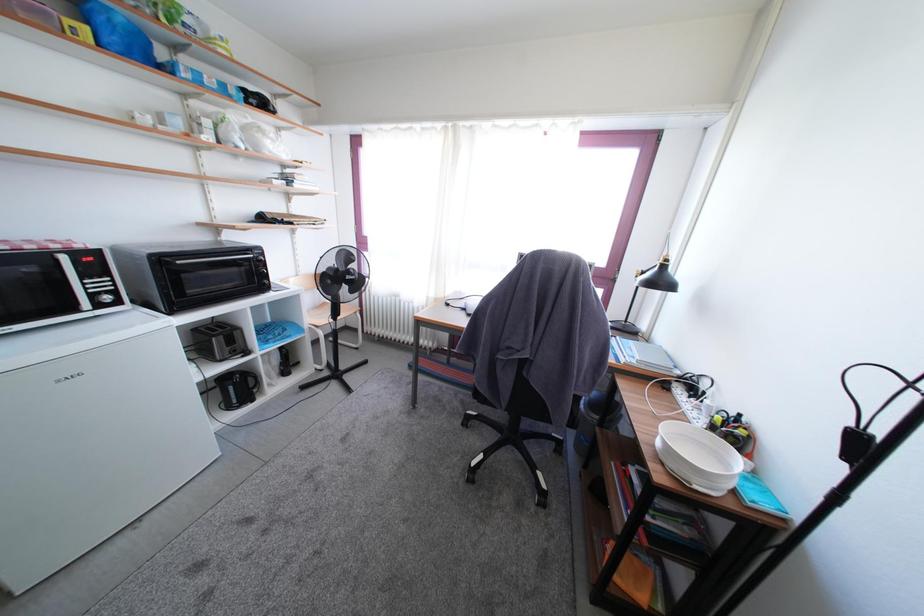
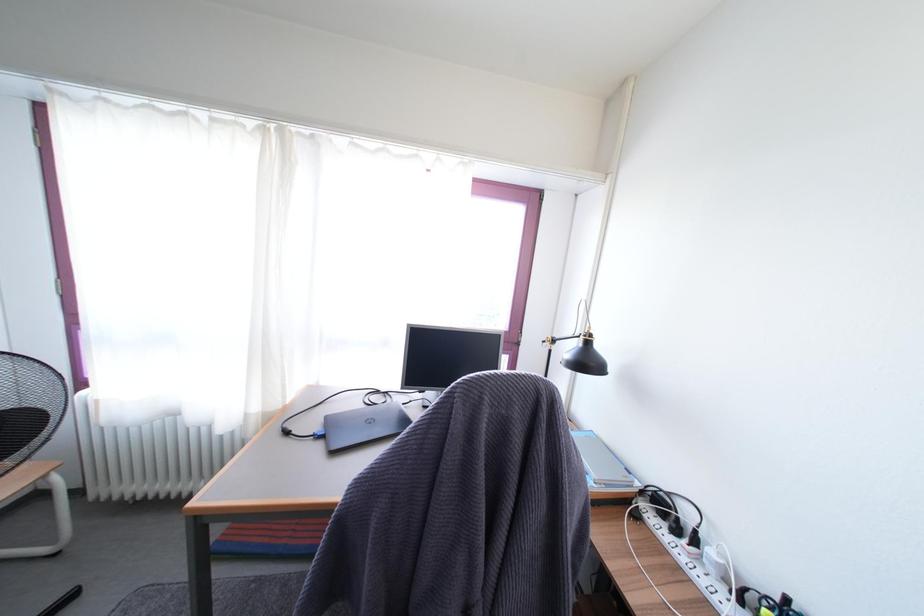
Question: Based on the continuous images, in which direction is the camera rotating? Reply with the corresponding letter.

Choices:
 (A) Left
 (B) Right
 (C) Up
 (D) Down

Answer: (B)